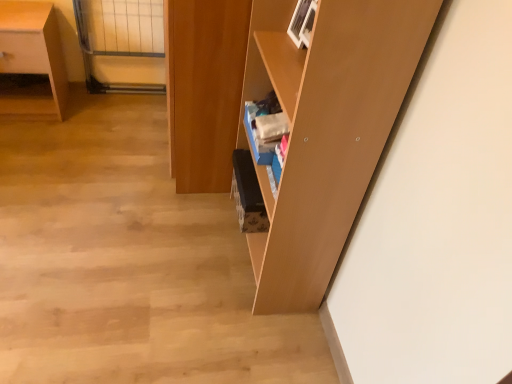
You are a GUI agent. You are given a task and a screenshot of the screen. Output one action in this format:
    pyautogui.click(x=<x>, y=<y>)
    Task: Click on the free spot to the right of matte wood desk at left
    The height and width of the screenshot is (384, 512).
    Given the screenshot: What is the action you would take?
    pyautogui.click(x=90, y=114)